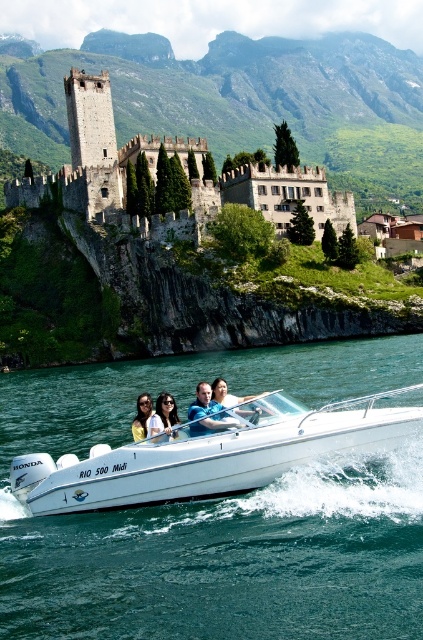
Question: Observing the image, what is the correct spatial positioning of white glossy boat at lower center in reference to stone medieval castle at center?

Choices:
 (A) right
 (B) left

Answer: (A)

Question: From the image, what is the correct spatial relationship of white glossy boat at lower center in relation to matte black hair at center?

Choices:
 (A) below
 (B) above

Answer: (A)

Question: Which of the following is the farthest from the observer?

Choices:
 (A) matte black sunglasses at center
 (B) matte black hair at center
 (C) clear blue water at boat front
 (D) smooth skin face at center

Answer: (A)

Question: Does matte black hair at center have a lesser width compared to smooth skin face at center?

Choices:
 (A) yes
 (B) no

Answer: (A)

Question: Considering the real-world distances, which object is closest to the stone medieval castle at center?

Choices:
 (A) clear blue water at boat front
 (B) white glossy boat at lower center
 (C) smooth tan skin at center
 (D) smooth skin face at center

Answer: (A)

Question: Which of these objects is positioned closest to the smooth tan skin at center?

Choices:
 (A) white glossy boat at lower center
 (B) matte black hair at center
 (C) smooth skin face at center
 (D) matte black sunglasses at center

Answer: (C)